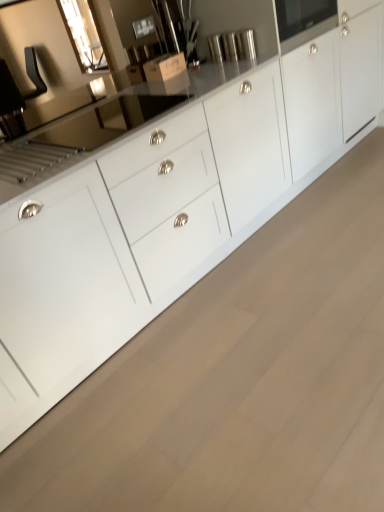
Locate an element on the screen. The height and width of the screenshot is (512, 384). white glossy cabinet at center is located at coordinates (238, 98).

Measure the distance between white glossy cabinet at center and camera.

white glossy cabinet at center is 4.56 feet away from camera.

Describe the element at coordinates (238, 98) in the screenshot. The width and height of the screenshot is (384, 512). I see `white glossy cabinet at center` at that location.

In order to face white glossy cabinet at center, should I rotate leftwards or rightwards?

To face it directly, rotate right by 14.334 degrees.

Where is `white glossy cabinet at center`? The height and width of the screenshot is (512, 384). white glossy cabinet at center is located at coordinates (238, 98).